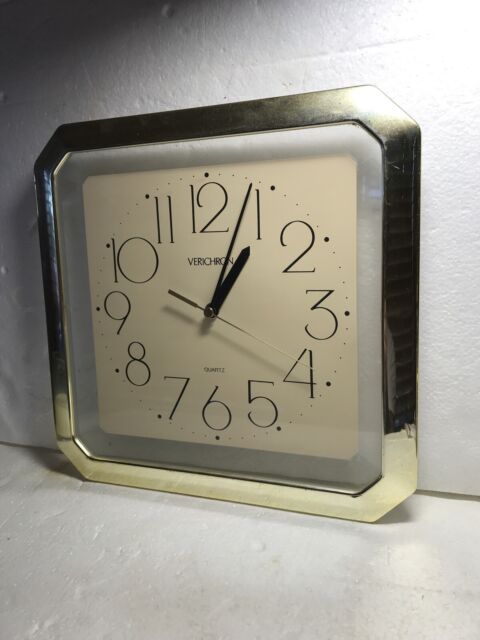
Find the location of a particular element. The image size is (480, 640). clock frame is located at coordinates (240, 116).